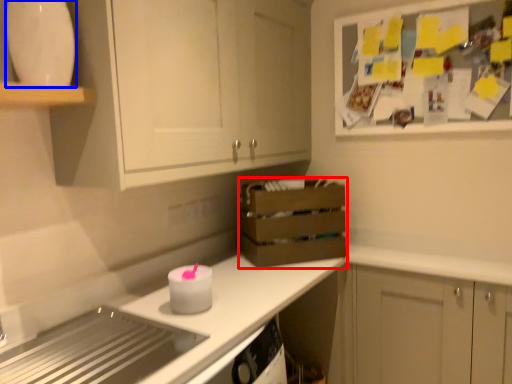
Question: Which point is further to the camera, crate (highlighted by a red box) or appliance (highlighted by a blue box)?

Choices:
 (A) crate
 (B) appliance

Answer: (A)